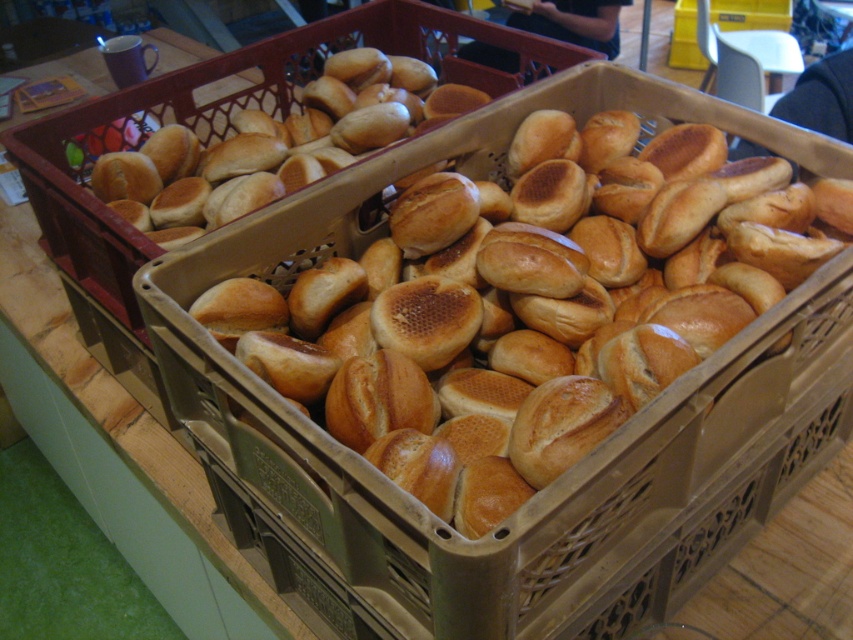
Who is higher up, golden brown crusty bread at center or golden brown crusty bread at upper left?

Positioned higher is golden brown crusty bread at upper left.

Find the location of a particular element. This screenshot has height=640, width=853. golden brown crusty bread at center is located at coordinates (520, 321).

Does golden brown crusty bread at center appear on the right side of golden brown plastic basket at center?

Yes, golden brown crusty bread at center is to the right of golden brown plastic basket at center.

Which of these two, golden brown crusty bread at center or golden brown plastic basket at center, stands shorter?

Standing shorter between the two is golden brown crusty bread at center.

This screenshot has width=853, height=640. What do you see at coordinates (520, 321) in the screenshot?
I see `golden brown crusty bread at center` at bounding box center [520, 321].

Locate an element on the screen. golden brown crusty bread at center is located at coordinates (520, 321).

Between golden brown plastic basket at center and golden brown crusty bread at upper left, which one has less height?

golden brown crusty bread at upper left

Describe the element at coordinates (227, 124) in the screenshot. I see `golden brown plastic basket at center` at that location.

Locate an element on the screen. golden brown plastic basket at center is located at coordinates (227, 124).

Where is `golden brown plastic basket at center`? Image resolution: width=853 pixels, height=640 pixels. golden brown plastic basket at center is located at coordinates pos(227,124).